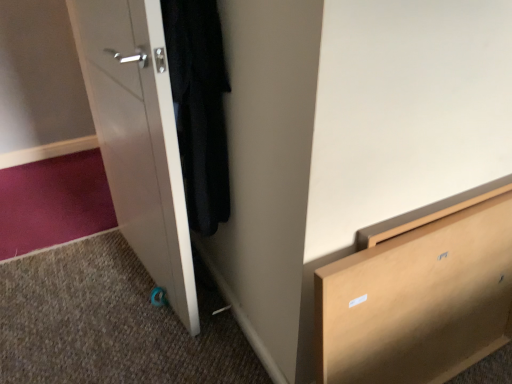
Question: From the image's perspective, is black matte coat at left located above light brown wooden chest of drawers at lower right?

Choices:
 (A) no
 (B) yes

Answer: (B)

Question: Is light brown wooden chest of drawers at lower right at the back of black matte coat at left?

Choices:
 (A) yes
 (B) no

Answer: (B)

Question: Would you say light brown wooden chest of drawers at lower right is part of black matte coat at left's contents?

Choices:
 (A) yes
 (B) no

Answer: (B)

Question: Does black matte coat at left have a smaller size compared to light brown wooden chest of drawers at lower right?

Choices:
 (A) no
 (B) yes

Answer: (B)

Question: Considering the relative sizes of black matte coat at left and light brown wooden chest of drawers at lower right in the image provided, is black matte coat at left bigger than light brown wooden chest of drawers at lower right?

Choices:
 (A) no
 (B) yes

Answer: (A)

Question: Is the position of black matte coat at left less distant than that of light brown wooden chest of drawers at lower right?

Choices:
 (A) no
 (B) yes

Answer: (A)

Question: Is black matte coat at left positioned far away from white glossy door at left?

Choices:
 (A) no
 (B) yes

Answer: (A)

Question: Does black matte coat at left have a lesser width compared to white glossy door at left?

Choices:
 (A) yes
 (B) no

Answer: (B)

Question: Is black matte coat at left placed right next to white glossy door at left?

Choices:
 (A) yes
 (B) no

Answer: (B)

Question: Is black matte coat at left at the left side of white glossy door at left?

Choices:
 (A) yes
 (B) no

Answer: (B)

Question: Can you confirm if black matte coat at left is wider than white glossy door at left?

Choices:
 (A) no
 (B) yes

Answer: (B)

Question: From the image's perspective, is black matte coat at left over white glossy door at left?

Choices:
 (A) yes
 (B) no

Answer: (A)

Question: Can you confirm if light brown wooden chest of drawers at lower right is positioned to the right of white glossy door at left?

Choices:
 (A) yes
 (B) no

Answer: (A)